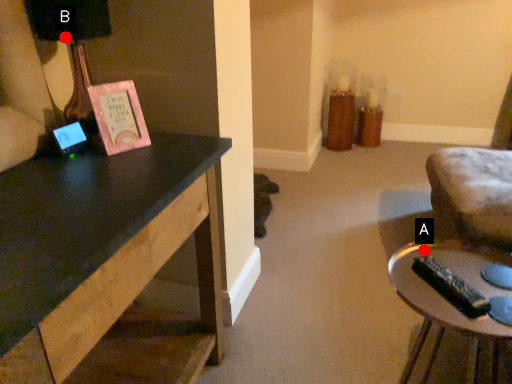
Question: Two points are circled on the image, labeled by A and B beside each circle. Which point is closer to the camera taking this photo?

Choices:
 (A) A is closer
 (B) B is closer

Answer: (A)